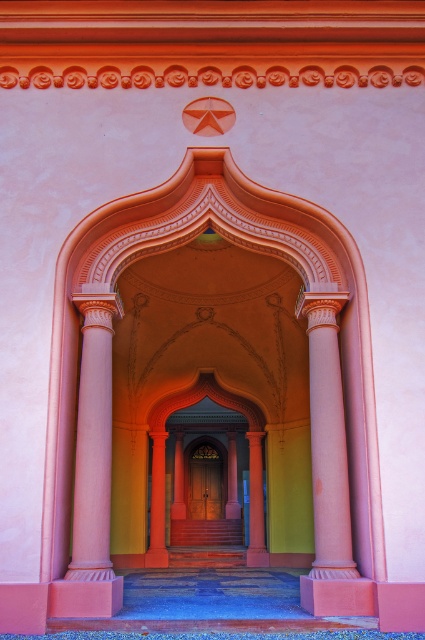
Which is more to the left, polished wood door at center or pink glossy column at center?

Positioned to the left is pink glossy column at center.

Between point (183, 502) and point (258, 458), which one is positioned behind?

Positioned behind is point (183, 502).

Where is `polished wood door at center`? This screenshot has height=640, width=425. polished wood door at center is located at coordinates (201, 397).

Is pink polished stone column at center positioned before polished wood door at center?

Yes, it is.

Is pink polished stone column at center taller than polished wood door at center?

Yes, pink polished stone column at center is taller than polished wood door at center.

Between point (326, 412) and point (155, 540), which one is positioned behind?

The point (155, 540) is more distant.

This screenshot has width=425, height=640. I want to click on pink polished stone column at center, so click(328, 440).

Does polished wood door at center have a smaller size compared to brown wooden door at center?

Indeed, polished wood door at center has a smaller size compared to brown wooden door at center.

This screenshot has width=425, height=640. Find the location of `polished wood door at center`. polished wood door at center is located at coordinates (201, 397).

The image size is (425, 640). Find the location of `polished wood door at center`. polished wood door at center is located at coordinates (201, 397).